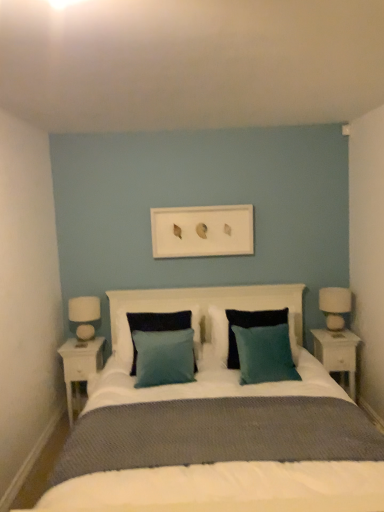
This screenshot has height=512, width=384. Find the location of `vacant space underneath white fabric lampshade at right (from a real-world perspective)`. vacant space underneath white fabric lampshade at right (from a real-world perspective) is located at coordinates (334, 333).